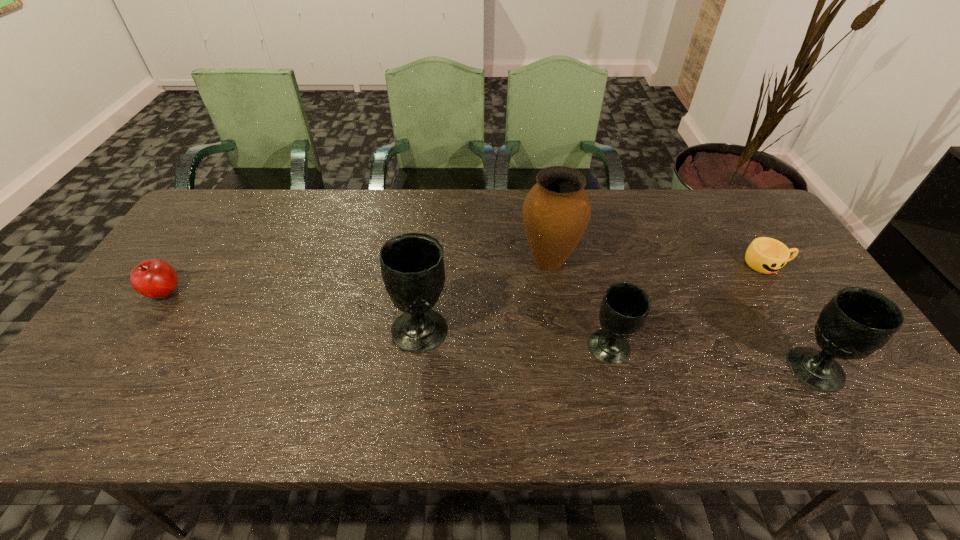
Image resolution: width=960 pixels, height=540 pixels. In order to click on the leftmost chalice in this screenshot , I will do `click(412, 264)`.

Find the location of a particular element. The width and height of the screenshot is (960, 540). the shortest chalice is located at coordinates (624, 309).

Where is `the second chalice from right to left`? The height and width of the screenshot is (540, 960). the second chalice from right to left is located at coordinates (624, 309).

You are a GUI agent. You are given a task and a screenshot of the screen. Output one action in this format:
    pyautogui.click(x=<x>, y=<y>)
    Task: Click on the rightmost chalice
    
    Given the screenshot: What is the action you would take?
    pyautogui.click(x=856, y=322)

The image size is (960, 540). What are the coordinates of `the second shortest chalice` in the screenshot? It's located at (856, 322).

This screenshot has width=960, height=540. In order to click on the shortest object in this screenshot , I will do `click(766, 255)`.

Where is `urn`? This screenshot has height=540, width=960. urn is located at coordinates pyautogui.click(x=556, y=212).

I want to click on apple, so click(x=154, y=278).

Where is `the leftmost object`? The height and width of the screenshot is (540, 960). the leftmost object is located at coordinates (154, 278).

I want to click on vacant space located on the back of the second object from left to right, so click(x=434, y=213).